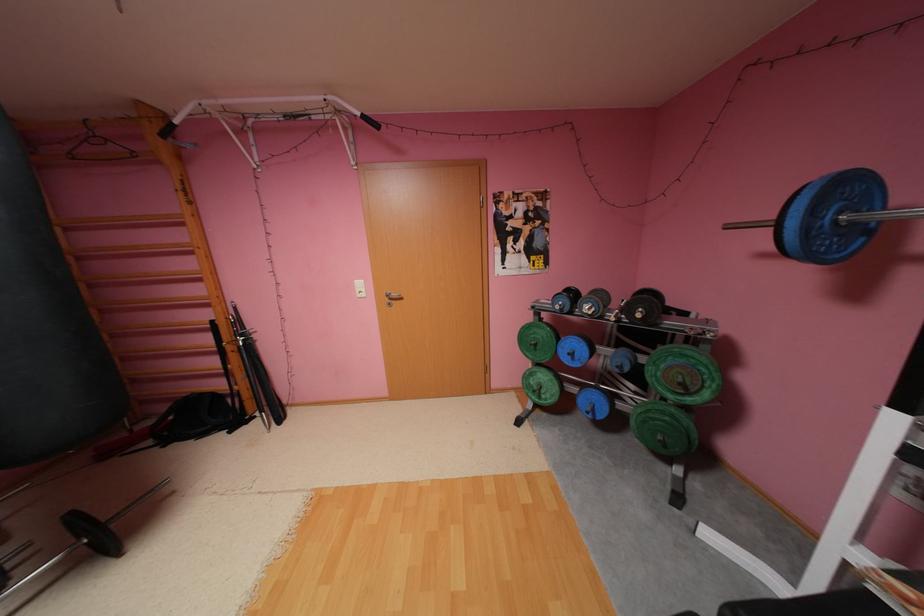
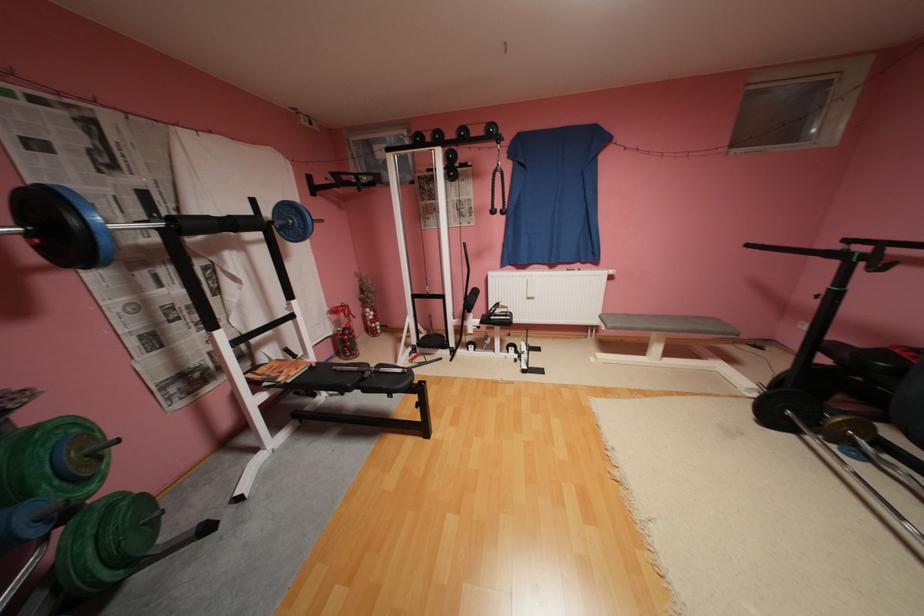
In the second image, find the point that corresponds to point (649, 410) in the first image.

(100, 551)